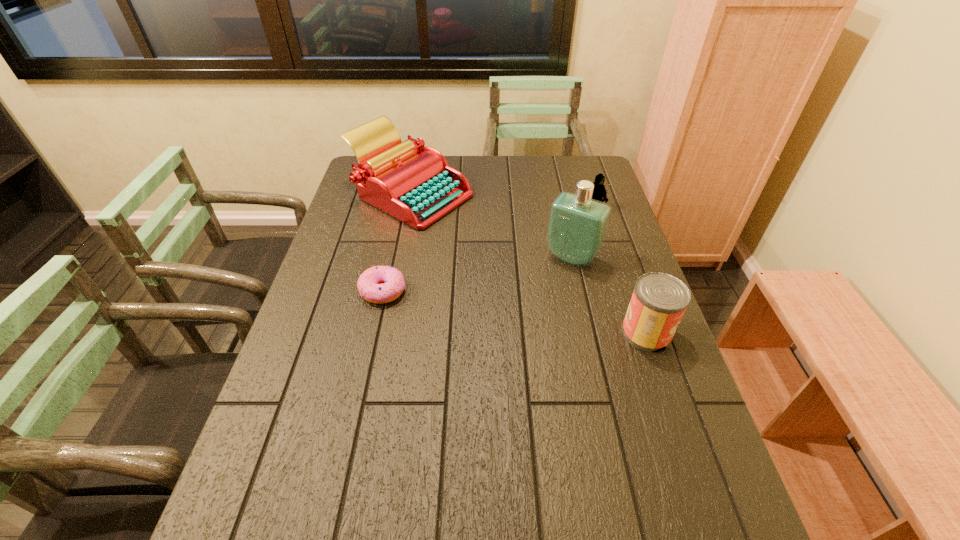
Locate an element on the screen. The image size is (960, 540). free region located 0.380m on the front label of the tallest object is located at coordinates (496, 367).

The image size is (960, 540). Identify the location of free space located on the front label of the tallest object. (516, 338).

At what (x,y) coordinates should I click in order to perform the action: click on free spot located 0.400m on the front label of the tallest object. Please return your answer as a coordinate pair (x, y). The image size is (960, 540). Looking at the image, I should click on (x=492, y=373).

Find the location of `free spot located 0.340m on the face of the fourth tallest object`. free spot located 0.340m on the face of the fourth tallest object is located at coordinates (526, 262).

Find the location of a particular element. free spot located on the face of the fourth tallest object is located at coordinates click(578, 220).

Locate an element on the screen. vacant space located on the face of the fourth tallest object is located at coordinates (544, 247).

Where is `vacant space located 0.160m on the typing side of the typewriter`? vacant space located 0.160m on the typing side of the typewriter is located at coordinates (447, 259).

You are a GUI agent. You are given a task and a screenshot of the screen. Output one action in this format:
    pyautogui.click(x=<x>, y=<y>)
    Task: Click on the vacant space positioned on the typing side of the typewriter
    The width and height of the screenshot is (960, 540).
    Given the screenshot: What is the action you would take?
    pyautogui.click(x=455, y=274)

I want to click on vacant region located 0.400m on the typing side of the typewriter, so click(x=478, y=315).

The image size is (960, 540). In order to click on object that is at the far edge in this screenshot , I will do 413,183.